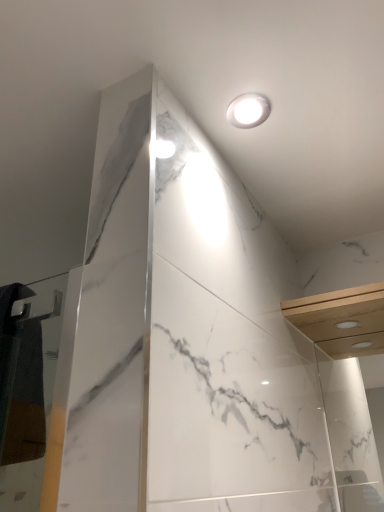
The height and width of the screenshot is (512, 384). I want to click on vacant region to the left of white glossy light fixture at upper center, so click(x=185, y=93).